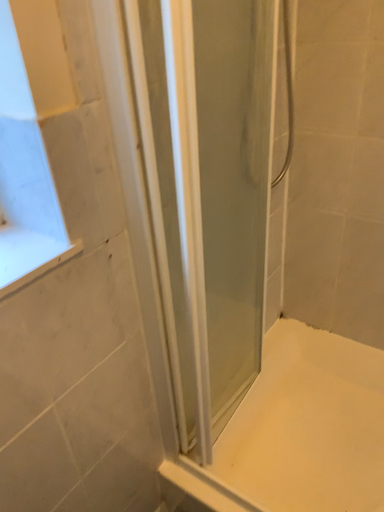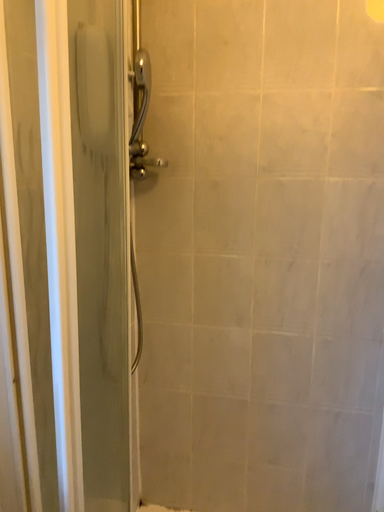
Question: How did the camera likely rotate when shooting the video?

Choices:
 (A) rotated upward
 (B) rotated downward

Answer: (A)